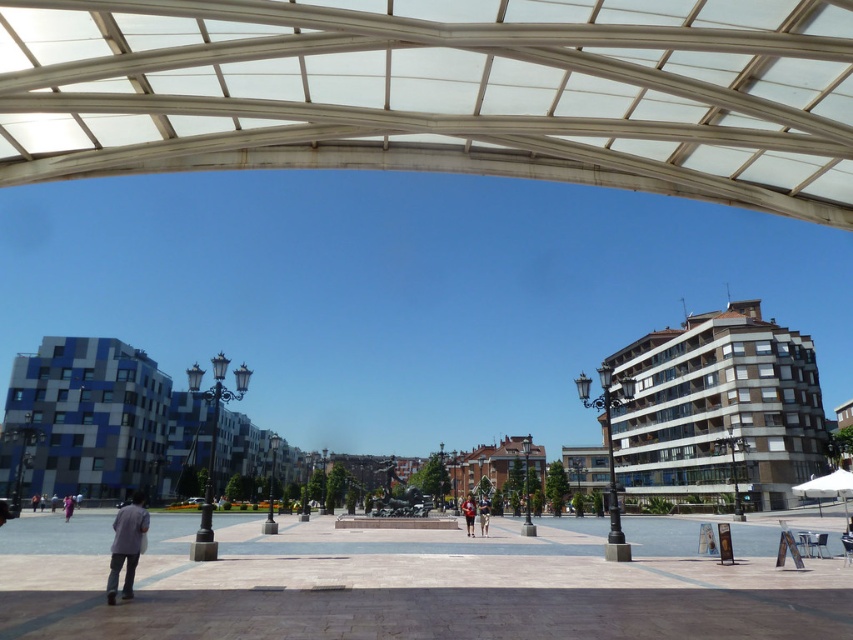
Does dark gray fabric jacket at lower left lie behind light blue denim jeans at lower left?

No, dark gray fabric jacket at lower left is closer to the viewer.

Is point (126, 595) closer to viewer compared to point (68, 496)?

That is True.

Is point (137, 540) farther from viewer compared to point (71, 493)?

No, it is not.

Locate an element on the screen. This screenshot has height=640, width=853. dark gray fabric jacket at lower left is located at coordinates (126, 545).

Between white fabric canopy at lower right and light blue denim jeans at lower left, which one appears on the right side from the viewer's perspective?

From the viewer's perspective, white fabric canopy at lower right appears more on the right side.

Between white fabric canopy at lower right and light blue denim jeans at lower left, which one has more height?

white fabric canopy at lower right

Is point (831, 488) behind point (70, 500)?

No, (831, 488) is in front of (70, 500).

Where is `white fabric canopy at lower right`? The image size is (853, 640). white fabric canopy at lower right is located at coordinates click(x=827, y=484).

Does dark gray fabric jacket at lower left appear over white fabric canopy at lower right?

Indeed, dark gray fabric jacket at lower left is positioned over white fabric canopy at lower right.

Is dark gray fabric jacket at lower left behind white fabric canopy at lower right?

No, dark gray fabric jacket at lower left is closer to the viewer.

Is point (128, 579) less distant than point (846, 474)?

Yes, point (128, 579) is closer to viewer.

Locate an element on the screen. The width and height of the screenshot is (853, 640). dark gray fabric jacket at lower left is located at coordinates click(x=126, y=545).